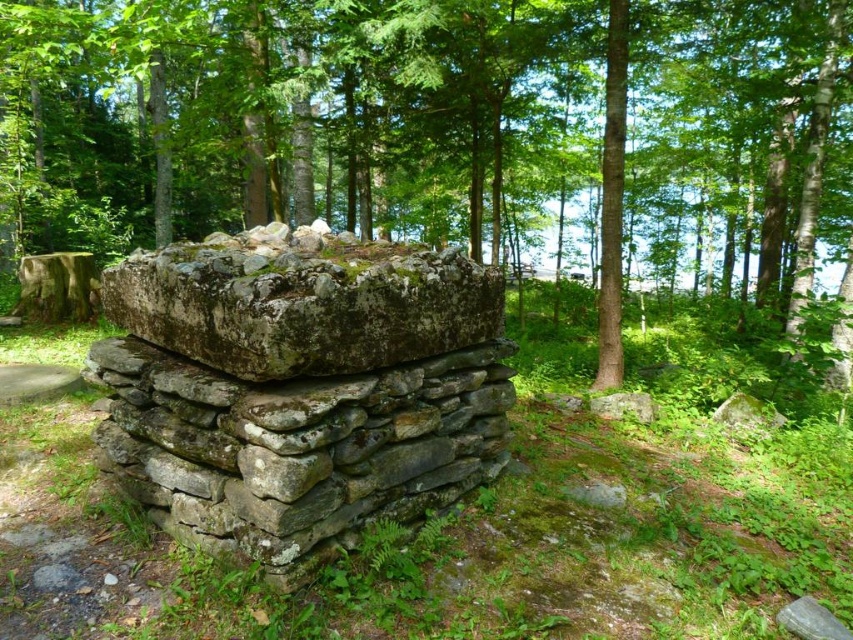
Question: Considering the real-world distances, which object is farthest from the green mossy stone at center?

Choices:
 (A) green rough bark tree at center
 (B) gray stone wall at center

Answer: (A)

Question: Does gray stone wall at center appear under green mossy stone at center?

Choices:
 (A) no
 (B) yes

Answer: (B)

Question: Can you confirm if green rough bark tree at center is positioned to the right of green mossy stone at center?

Choices:
 (A) yes
 (B) no

Answer: (B)

Question: Can you confirm if gray stone wall at center is positioned to the left of green mossy stone at center?

Choices:
 (A) yes
 (B) no

Answer: (B)

Question: Which point appears farthest from the camera in this image?

Choices:
 (A) (346, 250)
 (B) (744, 113)

Answer: (B)

Question: Estimate the real-world distances between objects in this image. Which object is closer to the green rough bark tree at center?

Choices:
 (A) gray stone wall at center
 (B) green mossy stone at center

Answer: (A)